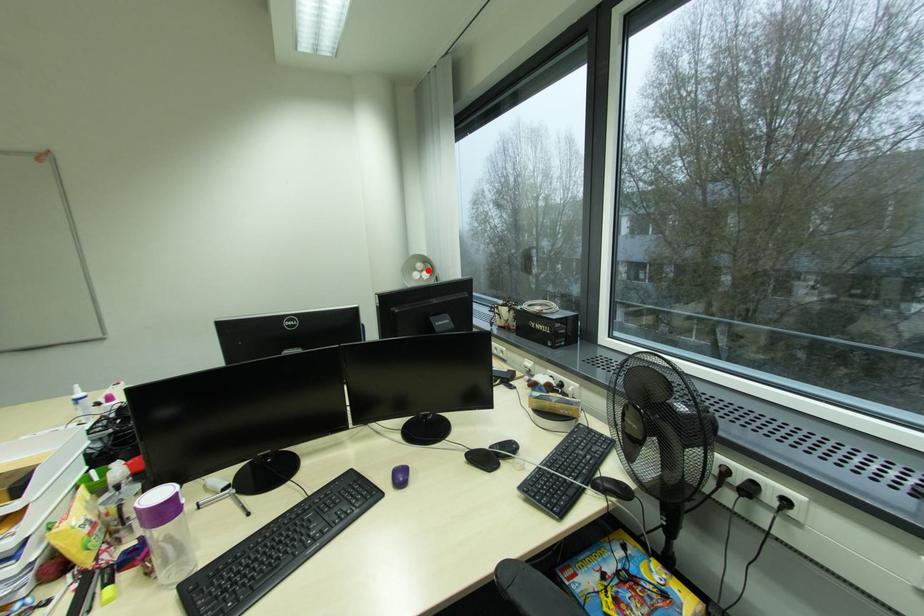
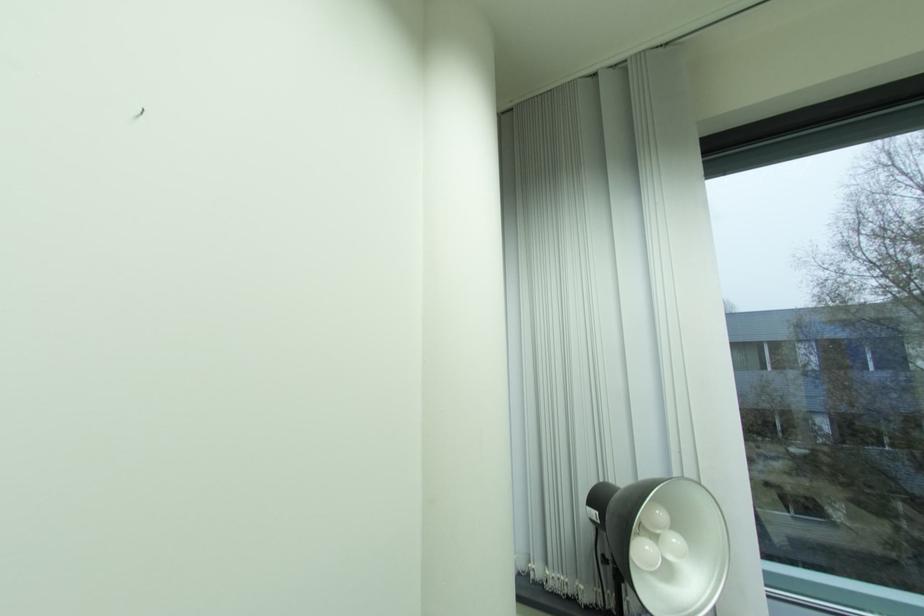
In the second image, find the point that corresponds to the highlighted location in the first image.

(665, 531)